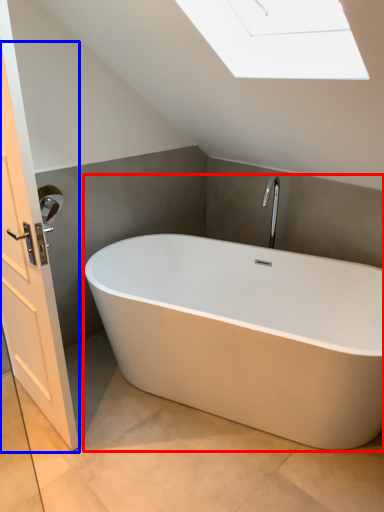
Question: Among these objects, which one is farthest to the camera, bathtub (highlighted by a red box) or screen door (highlighted by a blue box)?

Choices:
 (A) bathtub
 (B) screen door

Answer: (A)